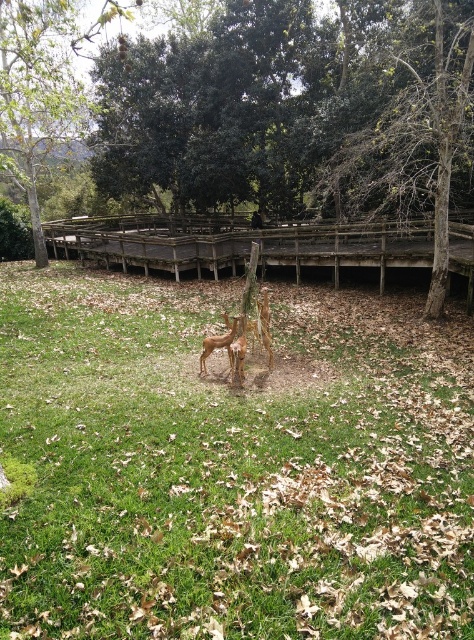
You are standing on the wooden walkway in the scene and want to look at the two points mentioned. Which point is closer to you, point at (426, 189) or point at (204, 364)?

Point at (204, 364) is closer to you because it is in front of point at (426, 189).

You are standing at the point marked by the coordinates point (x=231, y=465). What do you see directly below you?

The point (x=231, y=465) indicates green grass at center, so you are standing on green grass at center.